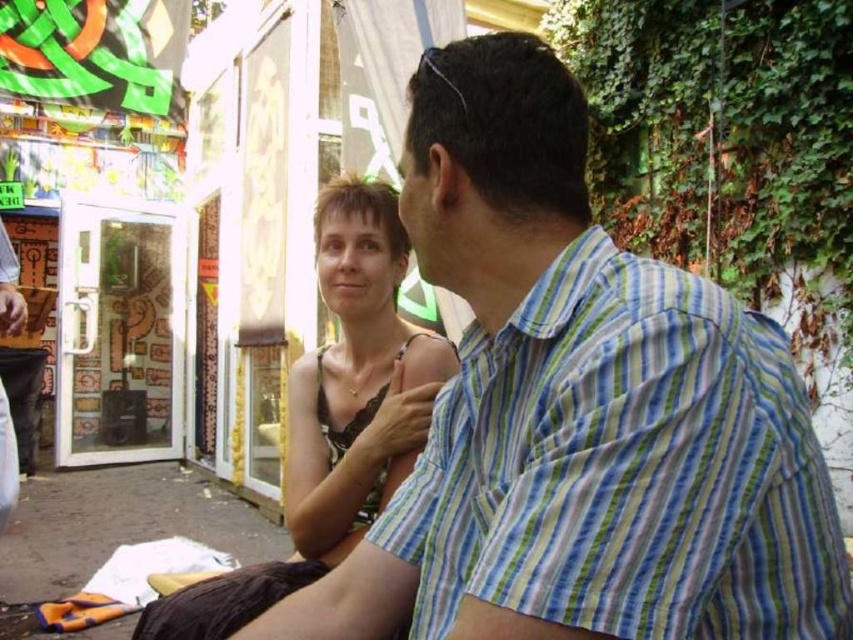
You are standing in front of the vibrant storefront at the market and notice two points marked in the scene. Which point, point [498,332] or point [387,186], is closer to you?

Point [498,332] is closer to the viewer than point [387,186].

You are a fashion designer observing two dresses displayed at a market stall. You see the black lace dress at center and the matte black dress at center. Which dress is closer to the front of the display?

The black lace dress at center is closer to the front of the display as it is positioned in front of the matte black dress at center.